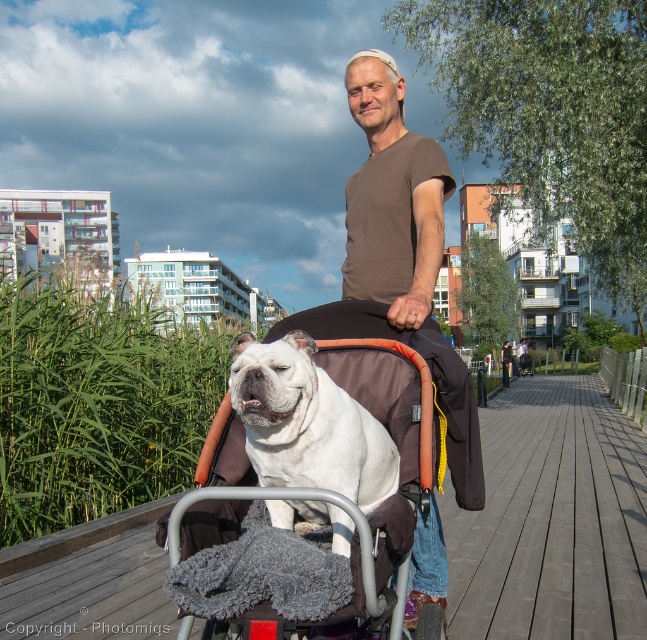
Does white fabric baby carriage at center appear on the right side of brown cotton t-shirt at center?

Incorrect, white fabric baby carriage at center is not on the right side of brown cotton t-shirt at center.

Which is behind, point (461, 416) or point (393, 179)?

Positioned behind is point (393, 179).

Locate an element on the screen. The image size is (647, 640). white fabric baby carriage at center is located at coordinates (250, 576).

Does brown cotton t-shirt at center have a lesser height compared to white fur dog at center?

Incorrect, brown cotton t-shirt at center's height does not fall short of white fur dog at center's.

Does brown cotton t-shirt at center appear on the left side of white fur dog at center?

No, brown cotton t-shirt at center is not to the left of white fur dog at center.

In order to click on brown cotton t-shirt at center in this screenshot , I will do `click(391, 198)`.

Is white fabric baby carriage at center behind white fur dog at center?

Yes, it is.

Does white fabric baby carriage at center have a greater width compared to white fur dog at center?

Yes.

Which is behind, point (375, 525) or point (289, 461)?

The point (289, 461) is behind.

At what (x,y) coordinates should I click in order to perform the action: click on white fabric baby carriage at center. Please return your answer as a coordinate pair (x, y). Looking at the image, I should click on (250, 576).